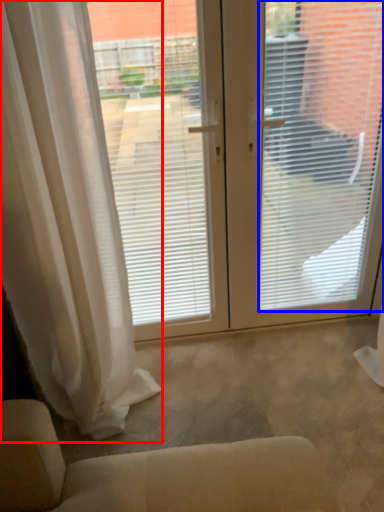
Question: Which object is further to the camera taking this photo, curtain (highlighted by a red box) or window blind (highlighted by a blue box)?

Choices:
 (A) curtain
 (B) window blind

Answer: (B)